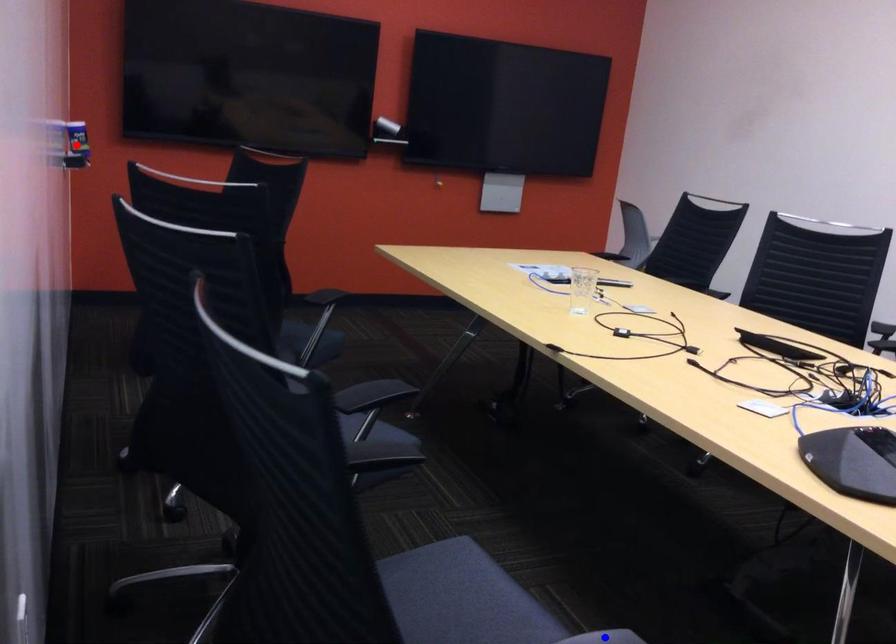
Question: Which of the two points in the image is closer to the camera?

Choices:
 (A) Blue point is closer.
 (B) Red point is closer.

Answer: (A)